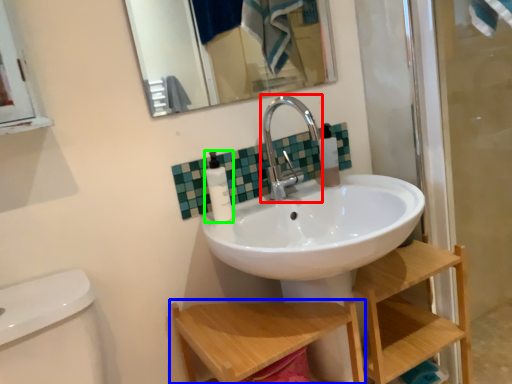
Question: Which is farther away from tap (highlighted by a red box)? step stool (highlighted by a blue box) or toiletry (highlighted by a green box)?

Choices:
 (A) step stool
 (B) toiletry

Answer: (A)